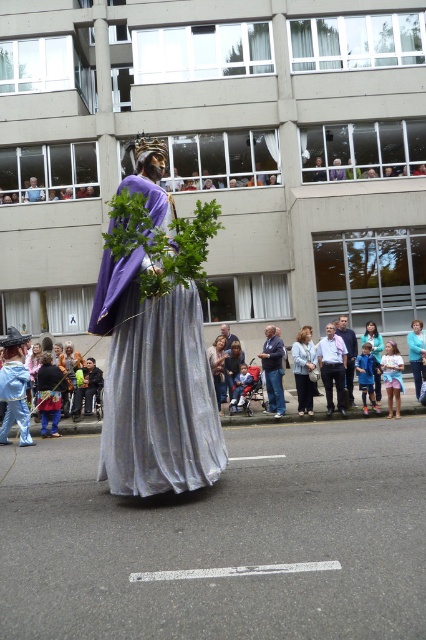
You are a photographer trying to capture both the blue denim jeans at center and the light blue fabric dress at center in the same frame. Which of the two should you focus on first to ensure both are in the shot?

The blue denim jeans at center is much taller than the light blue fabric dress at center, so you should focus on the blue denim jeans at center first to ensure both are in the shot.

You are a photographer trying to capture both the silvery metallic dress at center and the light blue denim dress at center in a single frame. Based on their widths, which dress should you focus on first to ensure both are fully visible in the photo?

The silvery metallic dress at center might be wider than the light blue denim dress at center, so focusing on the silvery metallic dress at center first would help ensure both dresses are fully captured in the photo.